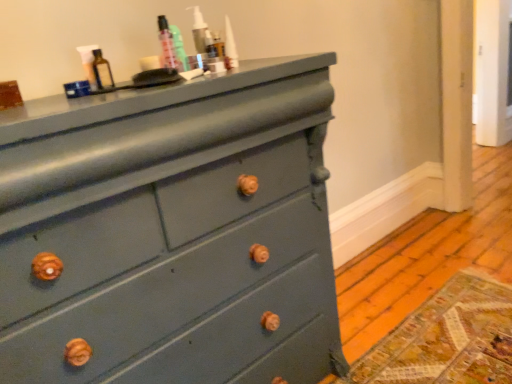
Where is `matte teal dresser at center`? matte teal dresser at center is located at coordinates (170, 232).

Describe the element at coordinates (179, 48) in the screenshot. I see `teal glossy bottle at upper center` at that location.

Locate an element on the screen. matte teal dresser at center is located at coordinates (170, 232).

Measure the distance between matte teal dresser at center and teal glossy bottle at upper center.

matte teal dresser at center and teal glossy bottle at upper center are 21.48 inches apart.

Does point (61, 315) come behind point (188, 65)?

No.

Is matte teal dresser at center far from teal glossy bottle at upper center?

No.

Would you say matte teal dresser at center is inside or outside teal glossy bottle at upper center?

matte teal dresser at center is spatially situated outside teal glossy bottle at upper center.

From the image's perspective, is teal glossy bottle at upper center located above matte teal dresser at center?

Indeed, from the image's perspective, teal glossy bottle at upper center is shown above matte teal dresser at center.

What's the angular difference between teal glossy bottle at upper center and matte teal dresser at center's facing directions?

0.502 degrees.

From their relative heights in the image, would you say teal glossy bottle at upper center is taller or shorter than matte teal dresser at center?

Considering their sizes, teal glossy bottle at upper center has less height than matte teal dresser at center.

Is teal glossy bottle at upper center oriented away from matte teal dresser at center?

No.

In the image, is matte glass bottle at upper center positioned in front of or behind teal glossy bottle at upper center?

Clearly, matte glass bottle at upper center is in front of teal glossy bottle at upper center.

This screenshot has height=384, width=512. Find the location of `teal that is on the right side of matte glass bottle at upper center`. teal that is on the right side of matte glass bottle at upper center is located at coordinates (179, 48).

Are matte glass bottle at upper center and teal glossy bottle at upper center beside each other?

No, matte glass bottle at upper center is not with teal glossy bottle at upper center.

Is point (100, 65) more distant than point (320, 179)?

No.

Considering the relative sizes of matte glass bottle at upper center and matte teal dresser at center in the image provided, is matte glass bottle at upper center smaller than matte teal dresser at center?

Indeed, matte glass bottle at upper center has a smaller size compared to matte teal dresser at center.

Is matte glass bottle at upper center directly adjacent to matte teal dresser at center?

There is a gap between matte glass bottle at upper center and matte teal dresser at center.

From the image's perspective, between matte glass bottle at upper center and matte teal dresser at center, which one is located above?

matte glass bottle at upper center is shown above in the image.

Where is `teal above the matte glass bottle at upper center (from the image's perspective)`? The image size is (512, 384). teal above the matte glass bottle at upper center (from the image's perspective) is located at coordinates (179, 48).

How different are the orientations of teal glossy bottle at upper center and matte glass bottle at upper center in degrees?

0.000769 degrees.

Is point (175, 48) less distant than point (99, 62)?

No.

From the image's perspective, would you say matte teal dresser at center is positioned over matte glass bottle at upper center?

Incorrect, from the image's perspective, matte teal dresser at center is lower than matte glass bottle at upper center.

Considering the points (207, 224) and (110, 86), which point is in front, point (207, 224) or point (110, 86)?

The point (110, 86) is closer to the camera.

Which object is positioned more to the right, matte teal dresser at center or matte glass bottle at upper center?

Positioned to the right is matte teal dresser at center.

From a real-world perspective, is matte teal dresser at center below matte glass bottle at upper center?

Indeed, from a real-world perspective, matte teal dresser at center is positioned beneath matte glass bottle at upper center.

Locate an element on the screen. This screenshot has height=384, width=512. teal on the right of matte teal dresser at center is located at coordinates (179, 48).

Identify the location of the chest of drawers that appears below the teal glossy bottle at upper center (from the image's perspective). pyautogui.click(x=170, y=232).

From the image, which object appears to be farther from teal glossy bottle at upper center, matte teal dresser at center or matte glass bottle at upper center?

matte teal dresser at center.

Based on their spatial positions, is matte glass bottle at upper center or matte teal dresser at center further from teal glossy bottle at upper center?

matte teal dresser at center.

Estimate the real-world distances between objects in this image. Which object is further from matte teal dresser at center, teal glossy bottle at upper center or matte glass bottle at upper center?

matte glass bottle at upper center is positioned further to the anchor matte teal dresser at center.

Based on their spatial positions, is teal glossy bottle at upper center or matte teal dresser at center further from matte glass bottle at upper center?

matte teal dresser at center is further to matte glass bottle at upper center.

From the picture: Which object lies further to the anchor point matte glass bottle at upper center, matte teal dresser at center or teal glossy bottle at upper center?

matte teal dresser at center is positioned further to the anchor matte glass bottle at upper center.

Based on their spatial positions, is matte glass bottle at upper center or teal glossy bottle at upper center further from matte teal dresser at center?

Among the two, matte glass bottle at upper center is located further to matte teal dresser at center.

The height and width of the screenshot is (384, 512). In order to click on bottle between teal glossy bottle at upper center and matte teal dresser at center from top to bottom in this screenshot , I will do `click(102, 71)`.